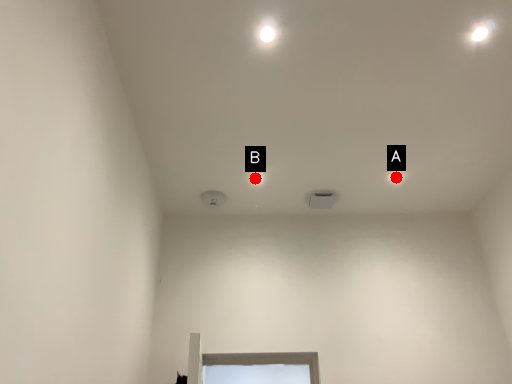
Question: Two points are circled on the image, labeled by A and B beside each circle. Which point is closer to the camera taking this photo?

Choices:
 (A) A is closer
 (B) B is closer

Answer: (B)